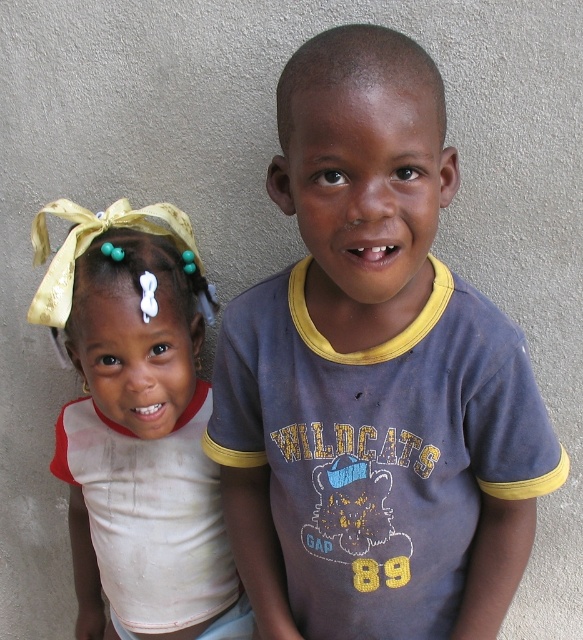
Who is more forward, [517,406] or [152,410]?

Point [517,406] is more forward.

Who is taller, dark blue t-shirt at center or white fabric headband at left?

white fabric headband at left

Who is more distant from viewer, (x=247, y=545) or (x=205, y=593)?

The point (x=205, y=593) is more distant.

Where is `dark blue t-shirt at center`? dark blue t-shirt at center is located at coordinates (374, 376).